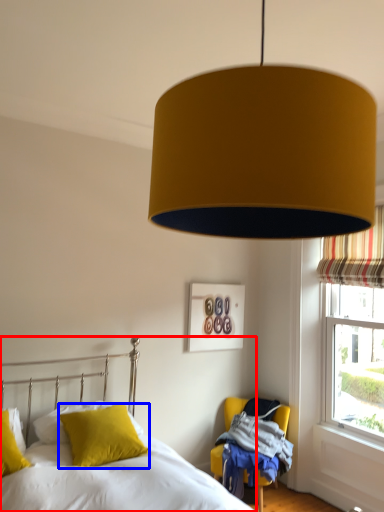
Question: Which of the following is the closest to the observer, bed (highlighted by a red box) or pillow (highlighted by a blue box)?

Choices:
 (A) bed
 (B) pillow

Answer: (A)